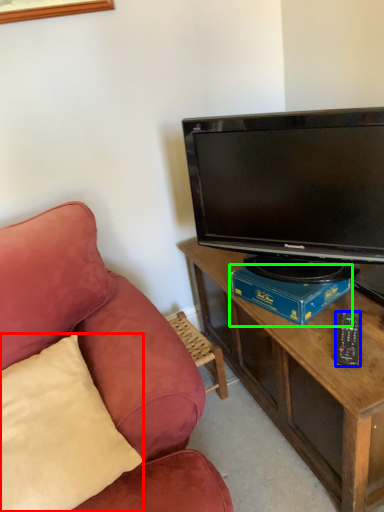
Question: Considering the real-world distances, which object is closest to pillow (highlighted by a red box)? remote control (highlighted by a blue box) or book (highlighted by a green box).

Choices:
 (A) remote control
 (B) book

Answer: (B)